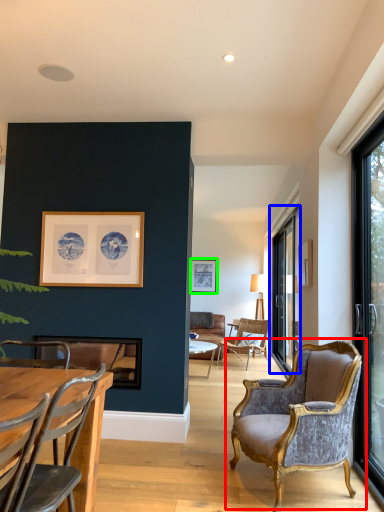
Question: Estimate the real-world distances between objects in this image. Which object is farther from chair (highlighted by a red box), window (highlighted by a blue box) or picture frame (highlighted by a green box)?

Choices:
 (A) window
 (B) picture frame

Answer: (B)